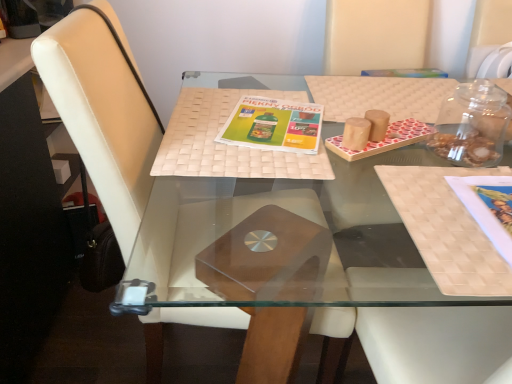
Question: Is woven beige placemat at center shorter than green matte magazine at center, which is the first book cover from top to bottom?

Choices:
 (A) yes
 (B) no

Answer: (B)

Question: Is woven beige placemat at center wider than green matte magazine at center, arranged as the 2th book cover when ordered from the bottom?

Choices:
 (A) yes
 (B) no

Answer: (A)

Question: From a real-world perspective, is woven beige placemat at center positioned under green matte magazine at center, which appears as the first book cover when viewed from the left, based on gravity?

Choices:
 (A) yes
 (B) no

Answer: (B)

Question: Does woven beige placemat at center lie in front of green matte magazine at center, arranged as the second book cover when viewed from the front?

Choices:
 (A) no
 (B) yes

Answer: (B)

Question: Is green matte magazine at center, which is the first book cover from top to bottom, completely or partially inside woven beige placemat at center?

Choices:
 (A) yes
 (B) no

Answer: (A)

Question: From the image's perspective, is matte paper book cover at right, placed as the 1th book cover when sorted from front to back, positioned above or below white leather chair at center?

Choices:
 (A) above
 (B) below

Answer: (A)

Question: Would you say matte paper book cover at right, which appears as the first book cover when ordered from the bottom, is inside or outside white leather chair at center?

Choices:
 (A) inside
 (B) outside

Answer: (B)

Question: Considering the positions of point (471, 192) and point (74, 59), is point (471, 192) closer or farther from the camera than point (74, 59)?

Choices:
 (A) farther
 (B) closer

Answer: (A)

Question: Based on their sizes in the image, would you say matte paper book cover at right, which appears as the first book cover when ordered from the bottom, is bigger or smaller than white leather chair at center?

Choices:
 (A) small
 (B) big

Answer: (A)

Question: Visually, is matte paper book cover at right, acting as the second book cover starting from the back, positioned to the left or to the right of wooden tray at center?

Choices:
 (A) right
 (B) left

Answer: (A)

Question: From a real-world perspective, relative to wooden tray at center, is matte paper book cover at right, which is counted as the second book cover, starting from the top, vertically above or below?

Choices:
 (A) below
 (B) above

Answer: (B)

Question: From the image's perspective, is matte paper book cover at right, placed as the 1th book cover when sorted from front to back, located above or below wooden tray at center?

Choices:
 (A) below
 (B) above

Answer: (B)

Question: Is point (506, 246) positioned closer to the camera than point (135, 253)?

Choices:
 (A) closer
 (B) farther

Answer: (A)

Question: Is wooden tray at center taller or shorter than green matte magazine at center, arranged as the 2th book cover when ordered from the bottom?

Choices:
 (A) short
 (B) tall

Answer: (B)

Question: From a real-world perspective, is wooden tray at center positioned above or below green matte magazine at center, arranged as the 2th book cover when ordered from the bottom?

Choices:
 (A) above
 (B) below

Answer: (B)